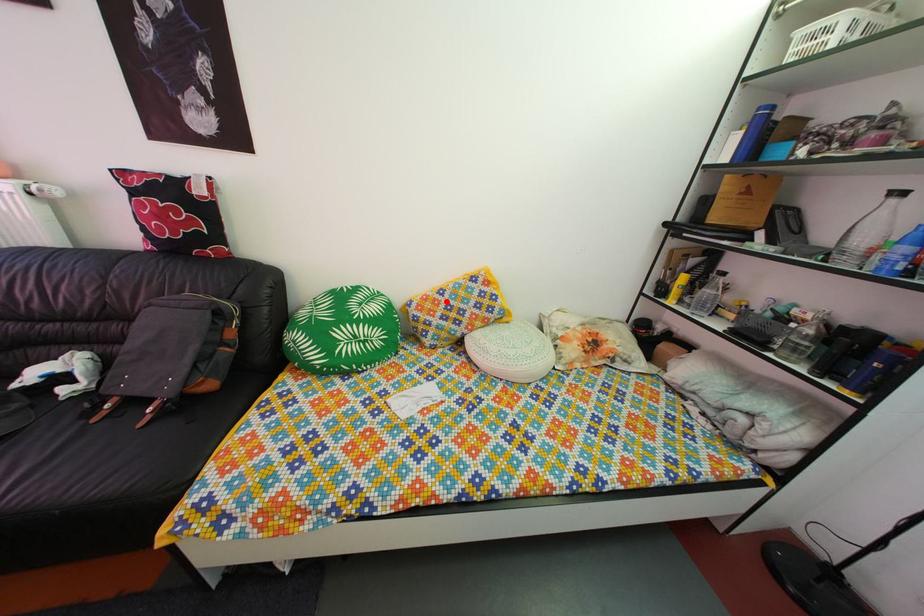
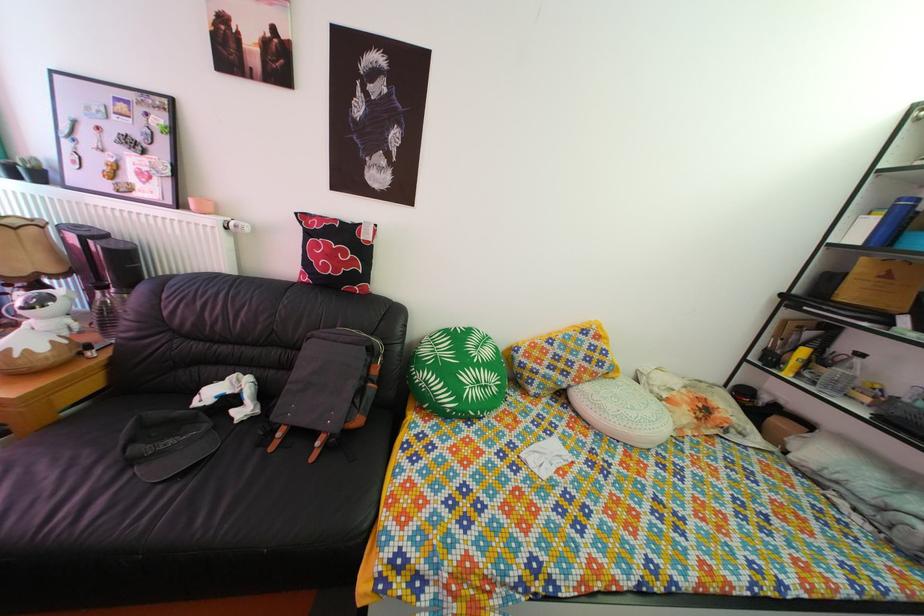
Find the pixel in the second image that matches the highlighted location in the first image.

(555, 351)